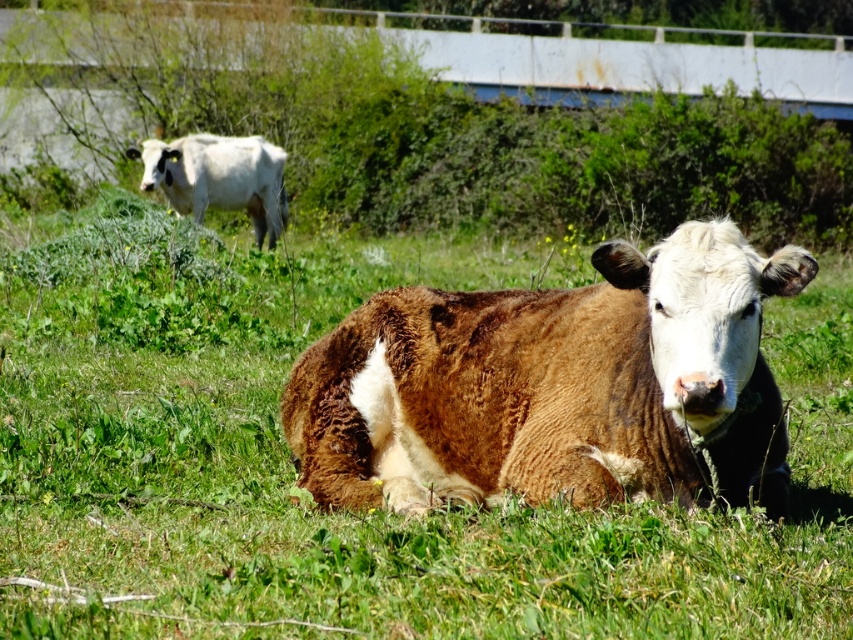
Question: Does green grassy at center have a greater width compared to brown furry cow at center?

Choices:
 (A) no
 (B) yes

Answer: (B)

Question: Can you confirm if green grassy at center is positioned below white smooth cow at upper left?

Choices:
 (A) yes
 (B) no

Answer: (A)

Question: Which is farther from the brown furry cow at center?

Choices:
 (A) green grassy at center
 (B) white smooth cow at upper left

Answer: (B)

Question: Can you confirm if brown furry cow at center is thinner than white smooth cow at upper left?

Choices:
 (A) yes
 (B) no

Answer: (B)

Question: Which point is closer to the camera?

Choices:
 (A) (372, 561)
 (B) (335, 381)
 (C) (265, 205)

Answer: (A)

Question: Among these objects, which one is nearest to the camera?

Choices:
 (A) white smooth cow at upper left
 (B) brown furry cow at center
 (C) green grassy at center

Answer: (C)